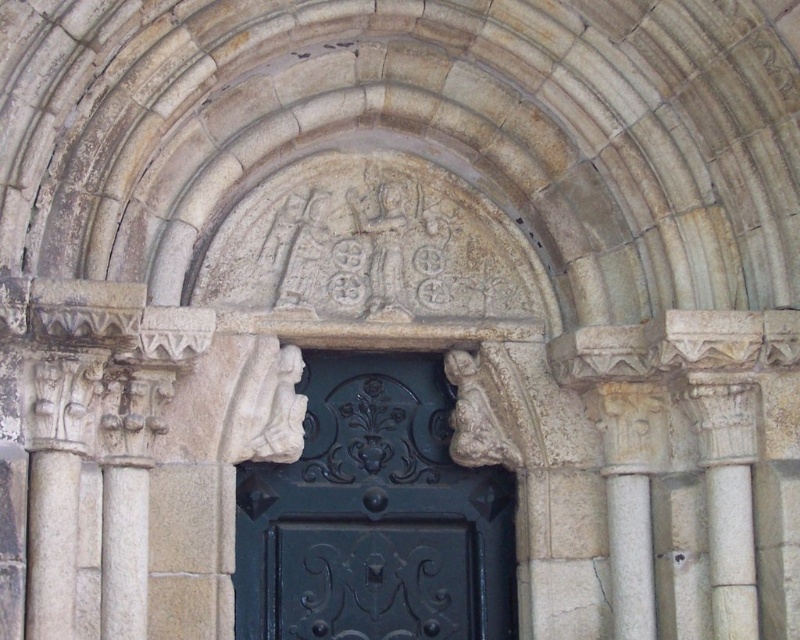
You are standing in front of the historical stone archway and need to enter through the green polished wood door at center. To your left, there is a white stone column at left. Which direction should you move to reach the door?

The green polished wood door at center is to the right of the white stone column at left, so you should move to your right to reach the door.